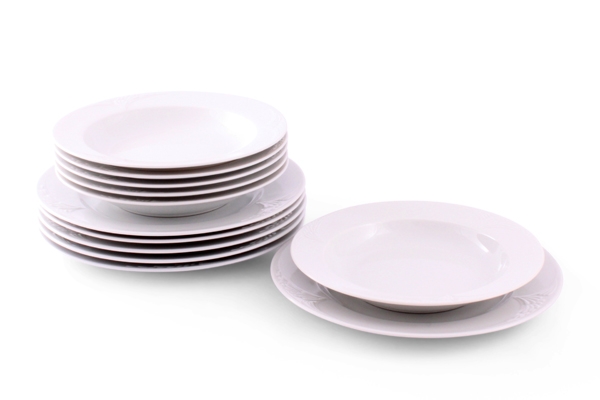
Where is `bowl`? This screenshot has width=600, height=400. bowl is located at coordinates (427, 301), (192, 205), (195, 194), (201, 184), (213, 172), (223, 159).